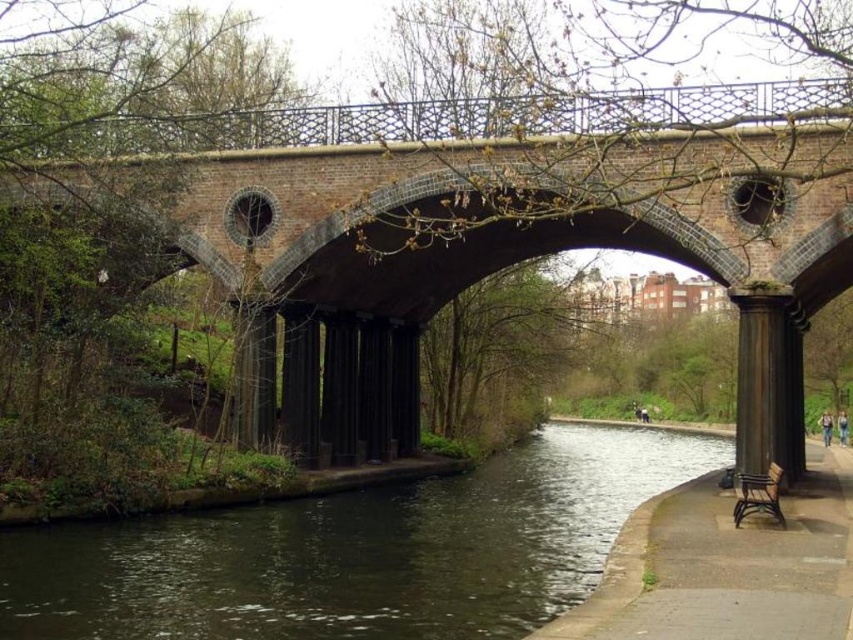
Question: Which object is positioned farthest from the dark brown water at center?

Choices:
 (A) rustic wood bench at lower right
 (B) brick arch bridge at center
 (C) smooth concrete path at lower right

Answer: (B)

Question: Does smooth concrete path at lower right have a smaller size compared to black polished stone column at right?

Choices:
 (A) yes
 (B) no

Answer: (A)

Question: Is brick arch bridge at center to the right of smooth concrete path at lower right from the viewer's perspective?

Choices:
 (A) yes
 (B) no

Answer: (B)

Question: Estimate the real-world distances between objects in this image. Which object is closer to the rustic wood bench at lower right?

Choices:
 (A) smooth concrete path at lower right
 (B) black polished stone column at right
 (C) brick arch bridge at center

Answer: (A)

Question: Which point is farther to the camera?

Choices:
 (A) dark brown water at center
 (B) brick arch bridge at center
 (C) rustic wood bench at lower right
 (D) smooth concrete path at lower right

Answer: (C)

Question: In this image, where is black polished stone column at right located relative to rustic wood bench at lower right?

Choices:
 (A) above
 (B) below

Answer: (A)